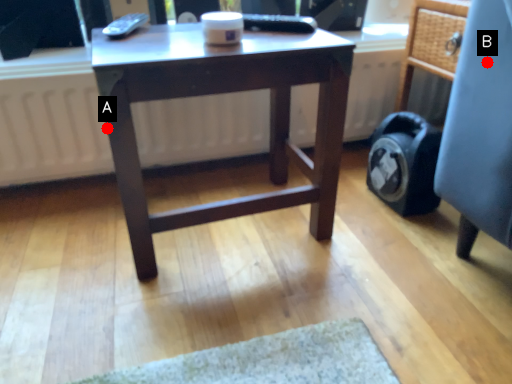
Question: Two points are circled on the image, labeled by A and B beside each circle. Which point is farther to the camera?

Choices:
 (A) A is further
 (B) B is further

Answer: (A)